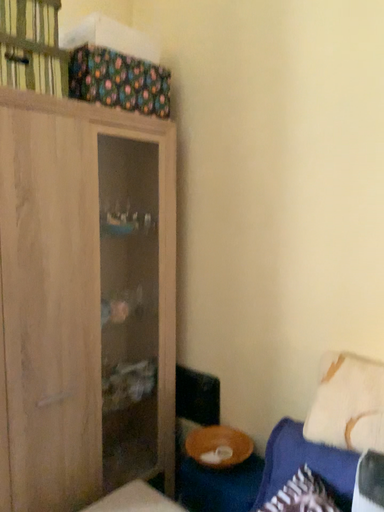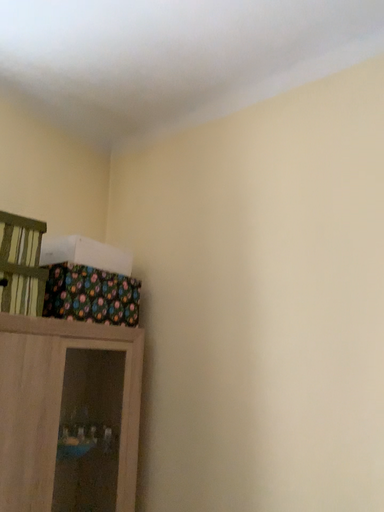
Question: Which way did the camera rotate in the video?

Choices:
 (A) rotated left
 (B) rotated right

Answer: (B)